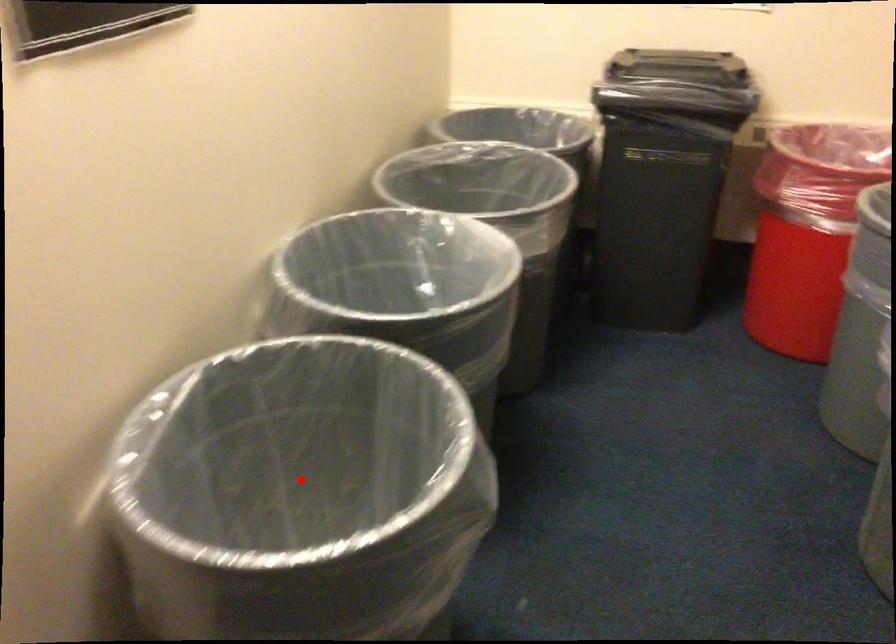
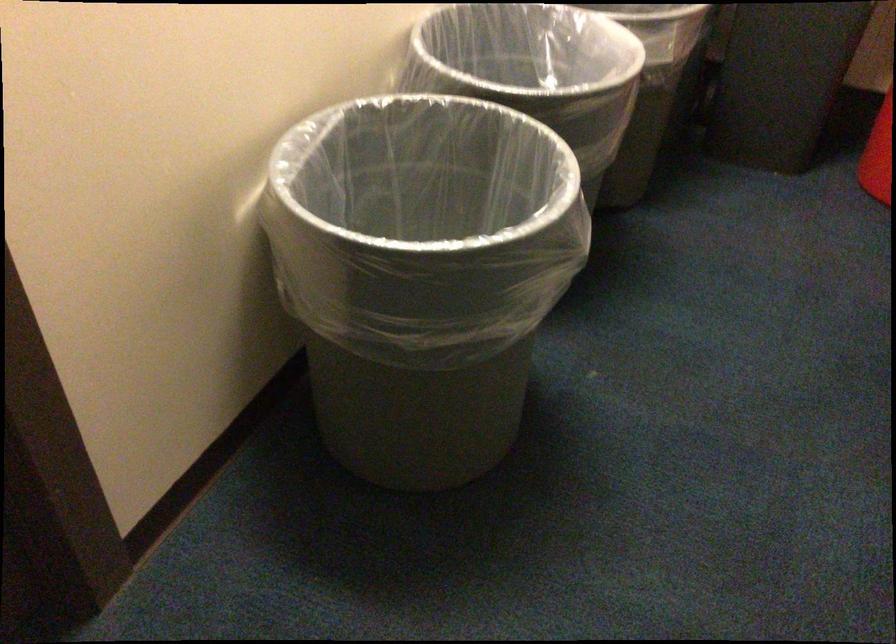
Question: I am providing you with two images of the same scene from different viewpoints. Image1 has a red point marked. In image2, the corresponding 3D location appears at what relative position? Reply with the corresponding letter.

Choices:
 (A) Closer
 (B) Farther

Answer: (B)